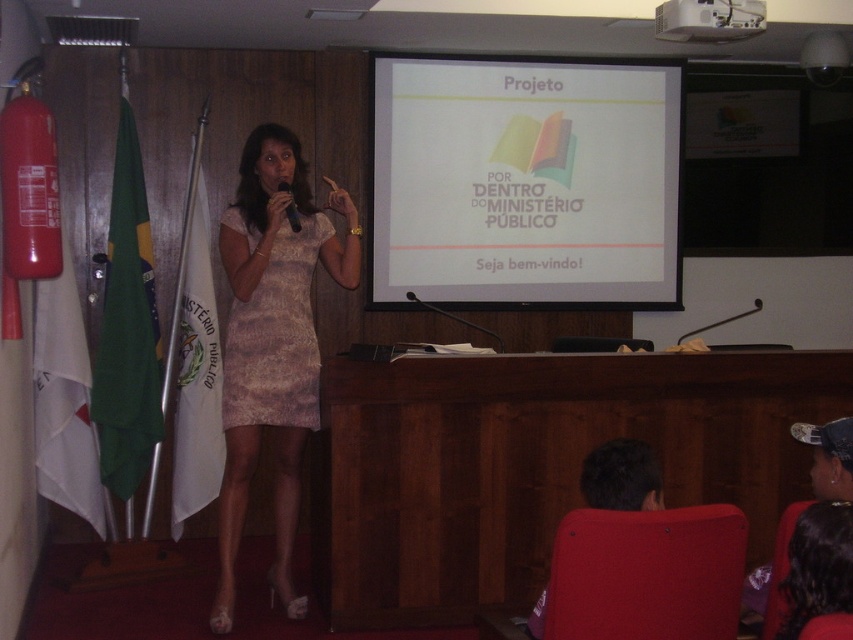
Question: Can you confirm if matte lace dress at center is positioned below white plastic projector at upper center?

Choices:
 (A) no
 (B) yes

Answer: (B)

Question: Estimate the real-world distances between objects in this image. Which object is farther from the metallic at upper center?

Choices:
 (A) black plastic microphone at center
 (B) white plastic projector at upper center
 (C) white matte projection screen at center

Answer: (B)

Question: Estimate the real-world distances between objects in this image. Which object is farther from the white plastic projector at upper center?

Choices:
 (A) metallic at upper center
 (B) white matte projection screen at center

Answer: (A)

Question: Which of the following is the farthest from the observer?

Choices:
 (A) (265, 273)
 (B) (705, 328)
 (C) (489, 333)

Answer: (B)

Question: Is matte lace dress at center closer to the viewer compared to metallic at upper center?

Choices:
 (A) yes
 (B) no

Answer: (A)

Question: Is lace-like beige dress at center positioned behind metallic at upper center?

Choices:
 (A) no
 (B) yes

Answer: (A)